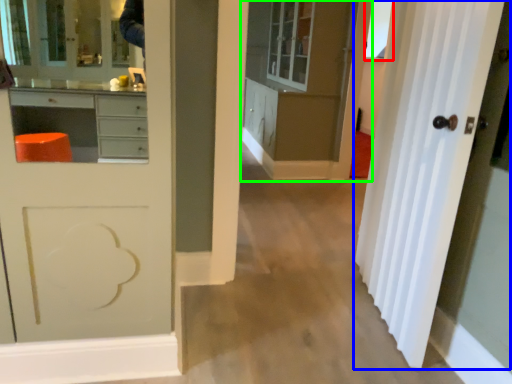
Question: Which object is positioned closest to window (highlighted by a red box)? Select from door (highlighted by a blue box) and cabinetry (highlighted by a green box).

Choices:
 (A) door
 (B) cabinetry

Answer: (B)